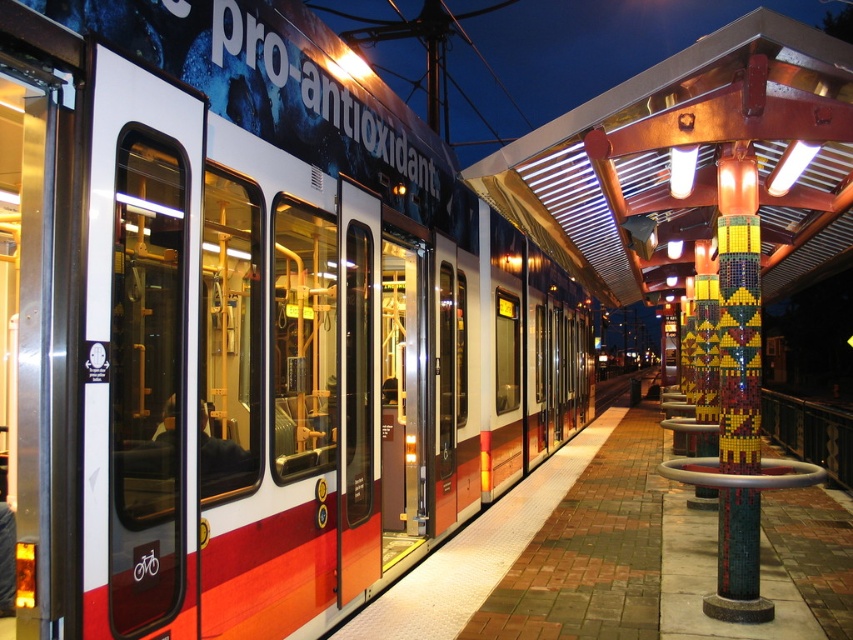
You are a maintenance worker at the tram station. You need to inspect both the mosaic tile column at right and the multicolored mosaic pillar at right. Which one should you check first if you want to start from the ground up?

The multicolored mosaic pillar at right should be checked first because the mosaic tile column at right is positioned over it, meaning the pillar is lower and closer to the ground.